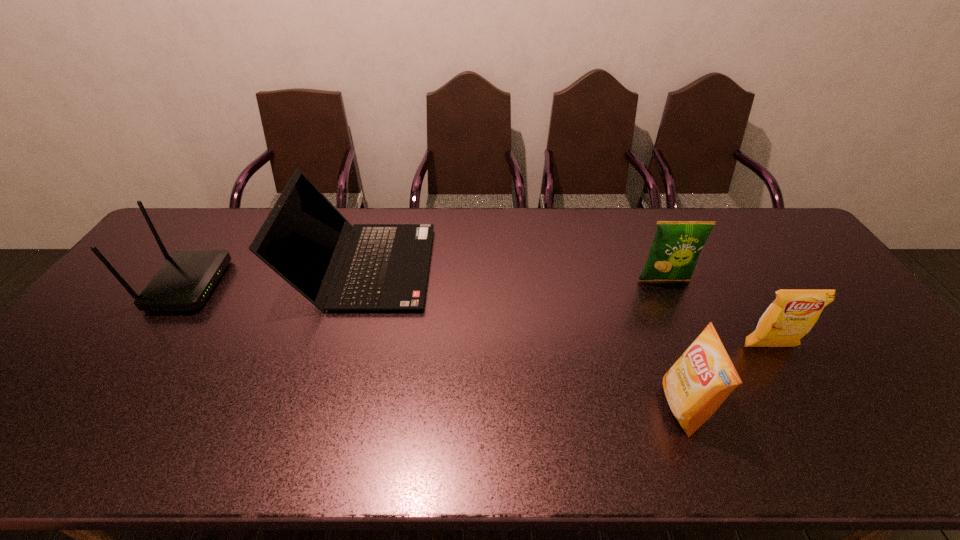
Where is `vacant point located between the router and the second object from left to right`? Image resolution: width=960 pixels, height=540 pixels. vacant point located between the router and the second object from left to right is located at coordinates (276, 276).

Locate an element on the screen. free space that is in between the nearest object and the second object from left to right is located at coordinates (523, 336).

You are a GUI agent. You are given a task and a screenshot of the screen. Output one action in this format:
    pyautogui.click(x=<x>, y=<y>)
    Task: Click on the vacant area between the second nearest object and the fourth object from right to left
    The image size is (960, 540).
    Given the screenshot: What is the action you would take?
    pyautogui.click(x=566, y=307)

You are a GUI agent. You are given a task and a screenshot of the screen. Output one action in this format:
    pyautogui.click(x=<x>, y=<y>)
    Task: Click on the vacant area that lies between the laptop computer and the farthest crisp (potato chip)
    
    Given the screenshot: What is the action you would take?
    pyautogui.click(x=514, y=273)

Locate an element on the screen. empty location between the farthest crisp (potato chip) and the rightmost crisp (potato chip) is located at coordinates (716, 314).

The image size is (960, 540). Find the location of `free space that is in between the nearest crisp (potato chip) and the leftmost object`. free space that is in between the nearest crisp (potato chip) and the leftmost object is located at coordinates (436, 346).

Locate an element on the screen. The width and height of the screenshot is (960, 540). empty space between the laptop computer and the leftmost object is located at coordinates (276, 276).

Find the location of a particular element. The width and height of the screenshot is (960, 540). blank region between the laptop computer and the rightmost crisp (potato chip) is located at coordinates (566, 307).

The height and width of the screenshot is (540, 960). In order to click on vacant space that's between the nearest object and the fourth object from right to left in this screenshot , I will do `click(523, 336)`.

This screenshot has width=960, height=540. I want to click on object that is the closest one to the nearest object, so click(x=793, y=313).